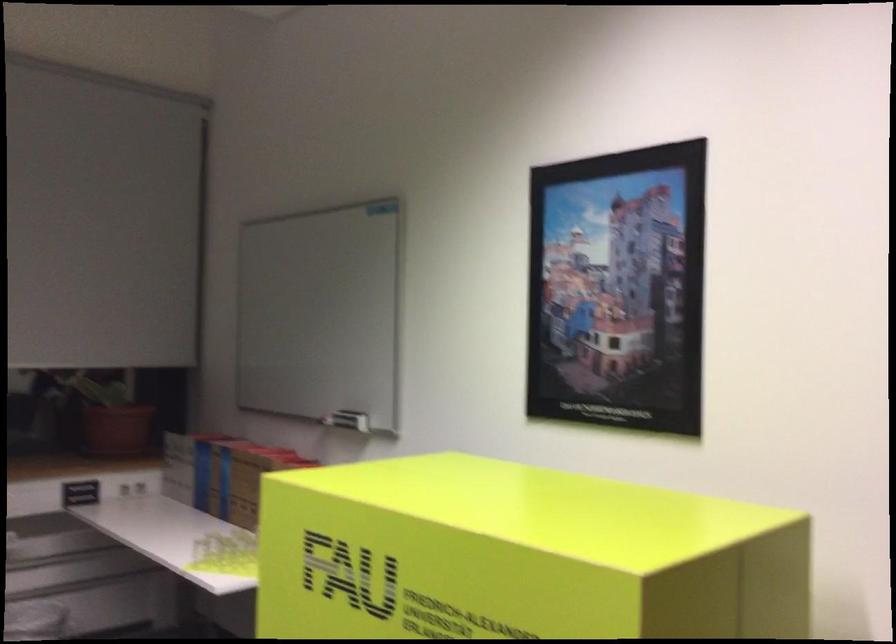
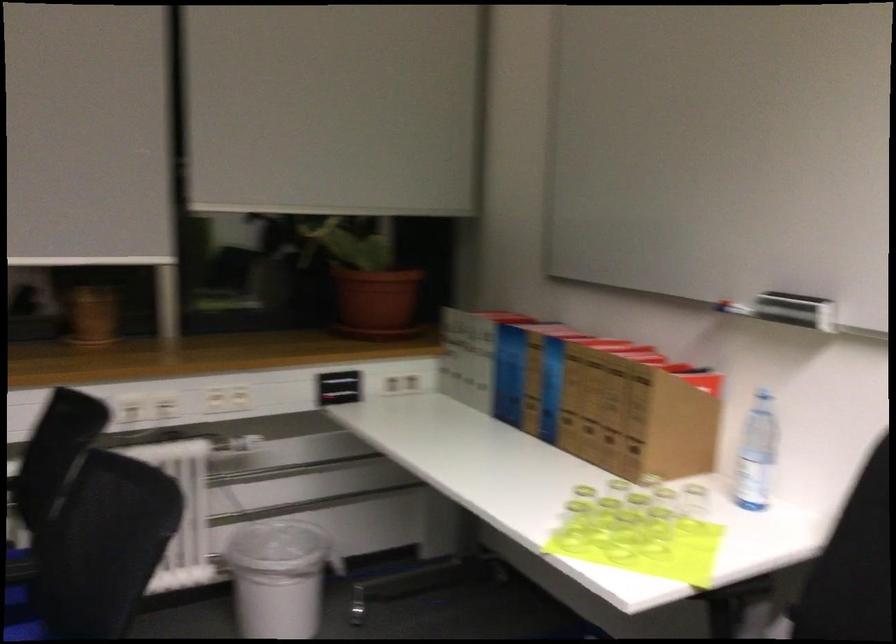
Find the pixel in the second image that matches the point at 238,560 in the first image.

(623, 536)